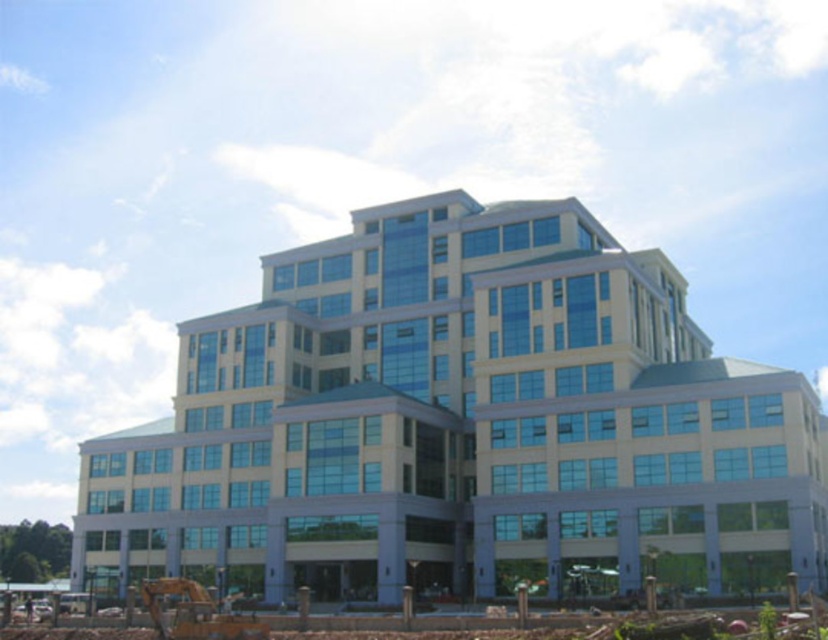
Does blue glass building at center have a lesser width compared to yellow metallic excavator at lower left?

No.

Who is lower down, blue glass building at center or yellow metallic excavator at lower left?

Positioned lower is yellow metallic excavator at lower left.

This screenshot has height=640, width=828. In order to click on blue glass building at center in this screenshot , I will do `click(461, 426)`.

Which is in front, point (444, 248) or point (431, 628)?

Point (431, 628) is in front.

Is blue glass building at center below brown dirt at lower left?

Actually, blue glass building at center is above brown dirt at lower left.

This screenshot has width=828, height=640. I want to click on blue glass building at center, so click(x=461, y=426).

The height and width of the screenshot is (640, 828). What are the coordinates of `blue glass building at center` in the screenshot? It's located at (461, 426).

From the picture: Between brown dirt at lower left and yellow metallic excavator at lower left, which one appears on the left side from the viewer's perspective?

Positioned to the left is yellow metallic excavator at lower left.

Does brown dirt at lower left have a greater height compared to yellow metallic excavator at lower left?

Correct, brown dirt at lower left is much taller as yellow metallic excavator at lower left.

Which is in front, point (461, 625) or point (217, 618)?

Point (461, 625) is in front.

Locate an element on the screen. The width and height of the screenshot is (828, 640). brown dirt at lower left is located at coordinates (297, 618).